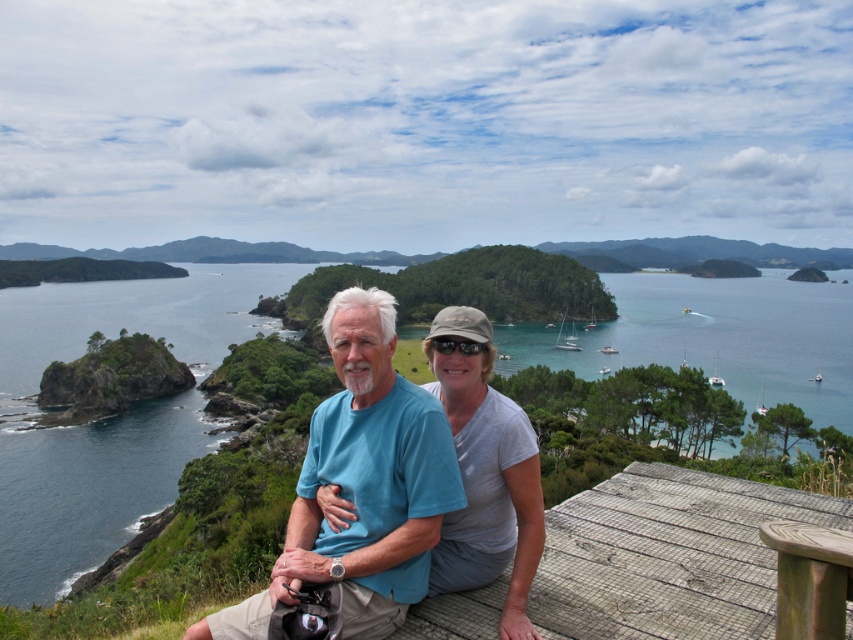
You are a photographer trying to capture the scene of the gray cotton shirt at center and the wooden picnic table at lower right. Based on their positions, which object should you focus on first if you want to include both in your shot without moving the camera?

The gray cotton shirt at center is located above the wooden picnic table at lower right, so you should focus on the gray cotton shirt at center first to ensure both are in frame without moving the camera.

You are planning to place a rectangular box that is 1.2 meters wide on the scene. The box must be placed either on the gray cotton shirt at center or the wooden picnic table at lower right. Based on their widths, which object can accommodate the box without it hanging over the edges?

The gray cotton shirt at center has a larger width than the wooden picnic table at lower right, so the box can be placed on the gray cotton shirt at center without hanging over the edges.